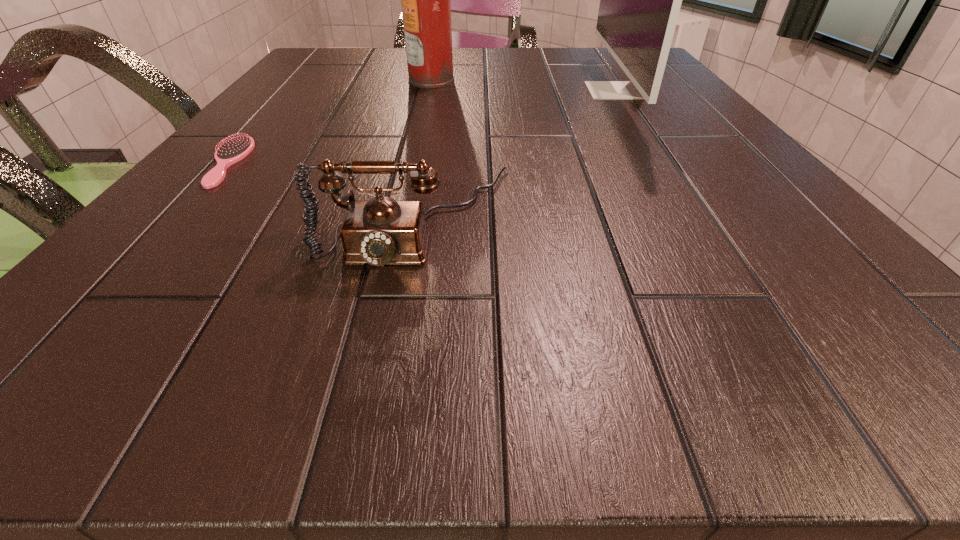
Find the location of a particular element. The height and width of the screenshot is (540, 960). fire extinguisher is located at coordinates (426, 0).

You are a GUI agent. You are given a task and a screenshot of the screen. Output one action in this format:
    pyautogui.click(x=<x>, y=<y>)
    Task: Click on the rightmost object
    The image size is (960, 540).
    Given the screenshot: What is the action you would take?
    pyautogui.click(x=640, y=0)

Where is `the third shortest object`? the third shortest object is located at coordinates (640, 0).

I want to click on the second shortest object, so click(382, 231).

Where is `the shortest object`? Image resolution: width=960 pixels, height=540 pixels. the shortest object is located at coordinates (232, 150).

Locate an element on the screen. Image resolution: width=960 pixels, height=540 pixels. hairbrush is located at coordinates coord(232,150).

Locate an element on the screen. This screenshot has height=540, width=960. vacant space located at the nozzle of the fire extinguisher is located at coordinates (501, 80).

Where is `vacant position located 0.390m on the front-facing side of the monitor`? The image size is (960, 540). vacant position located 0.390m on the front-facing side of the monitor is located at coordinates (411, 91).

Where is `blank space located 0.210m on the front-facing side of the monitor`? blank space located 0.210m on the front-facing side of the monitor is located at coordinates (493, 91).

Identify the location of vacant area situated 0.290m on the front-facing side of the monitor. The width and height of the screenshot is (960, 540). (457, 91).